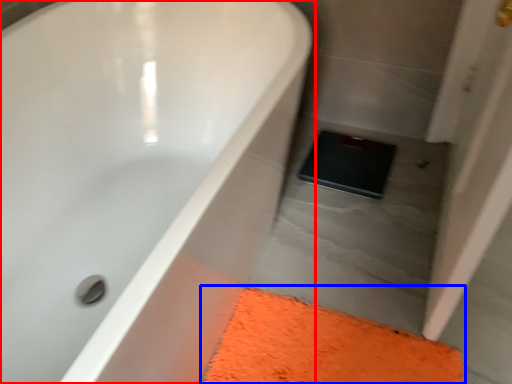
Question: Among these objects, which one is farthest to the camera, bathtub (highlighted by a red box) or bath mat (highlighted by a blue box)?

Choices:
 (A) bathtub
 (B) bath mat

Answer: (B)